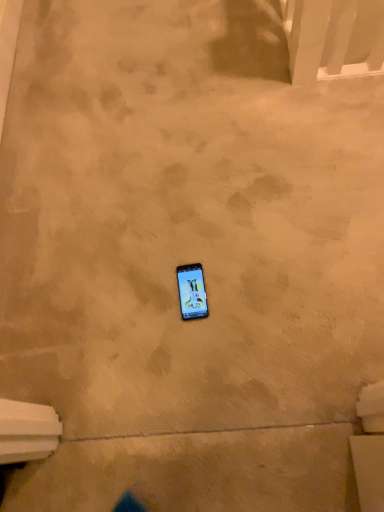
What do you see at coordinates (192, 291) in the screenshot? I see `matte black phone at center` at bounding box center [192, 291].

This screenshot has height=512, width=384. Identify the location of matte black phone at center. (192, 291).

Where is `matte black phone at center`? This screenshot has width=384, height=512. matte black phone at center is located at coordinates (192, 291).